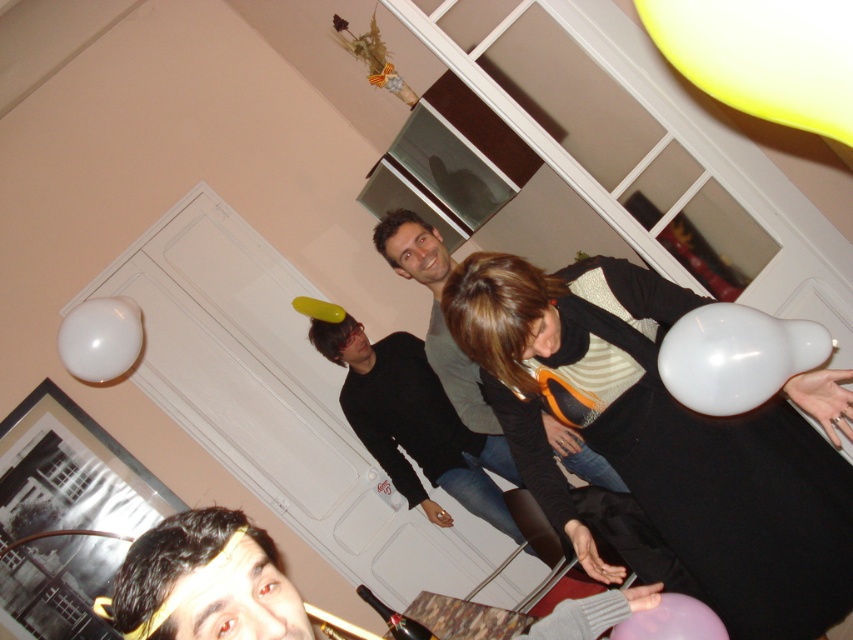
You are at a party and want to take a photo of the shiny gold headband at lower left and the black matte shirt at center. Which object is shorter?

The shiny gold headband at lower left is shorter than the black matte shirt at center.

You are at a party and want to take a photo of the shiny gold headband at lower left and the yellow matte balloon at upper right. Which object is positioned lower in the frame?

The shiny gold headband at lower left is positioned lower in the frame than the yellow matte balloon at upper right.